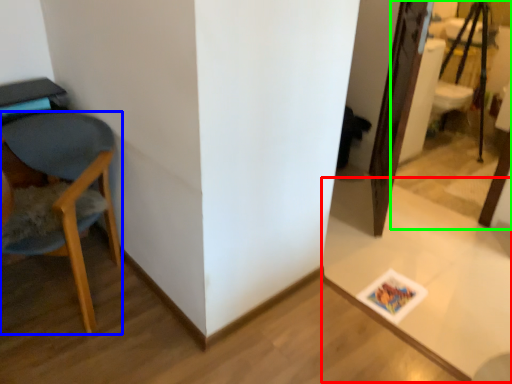
Question: Which is nearer to the table (highlighted by a red box)? chair (highlighted by a blue box) or mirror (highlighted by a green box).

Choices:
 (A) chair
 (B) mirror

Answer: (A)